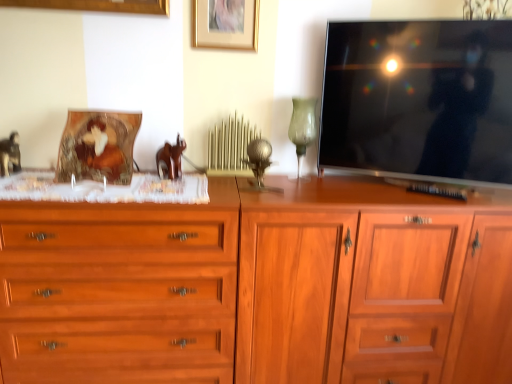
This screenshot has width=512, height=384. Find the location of `space that is in front of green glass vase at upper center, placed as the 1th table lamp when sorted from right to left`. space that is in front of green glass vase at upper center, placed as the 1th table lamp when sorted from right to left is located at coordinates (304, 189).